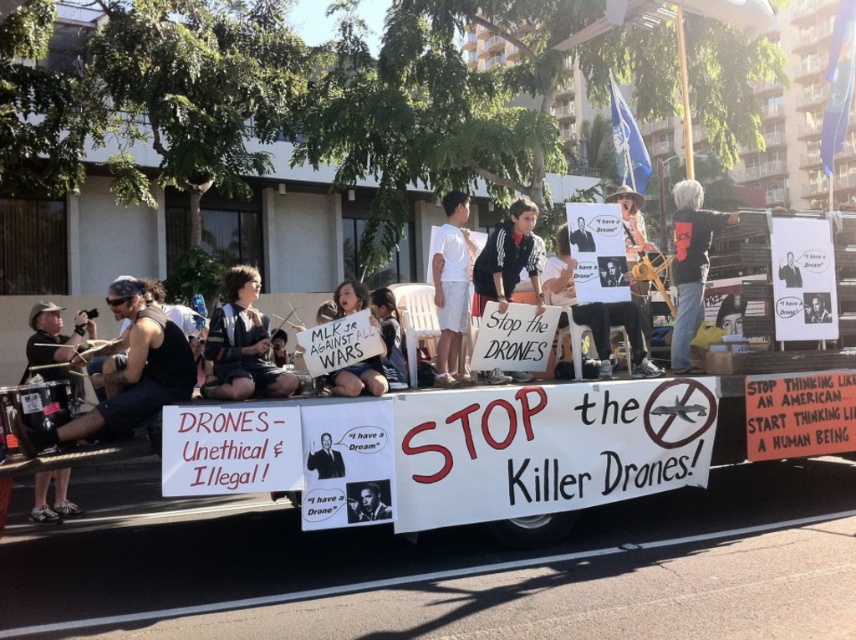
What is the spatial relationship between the white cotton shorts at center and the black glossy poster at center in the protest scene?

The white cotton shorts at center are closer to the viewer than the black glossy poster at center, meaning the poster is positioned behind the shorts in the scene.

You are a photographer trying to capture a clear photo of the dark blue uniform at center and the white cotton shorts at center. Which clothing item will appear taller in the photo?

The white cotton shorts at center are taller than the dark blue uniform at center, so they will appear taller in the photo.